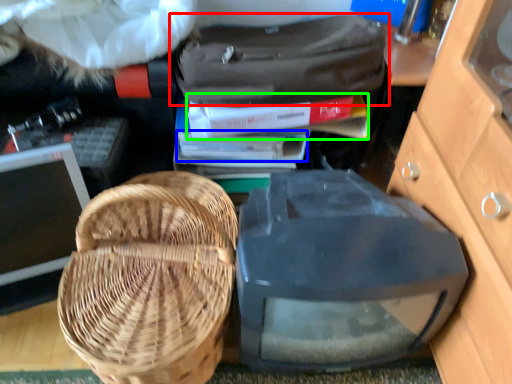
Question: Estimate the real-world distances between objects in this image. Which object is closer to luggage and bags (highlighted by a red box), book (highlighted by a blue box) or book (highlighted by a green box)?

Choices:
 (A) book
 (B) book

Answer: (B)